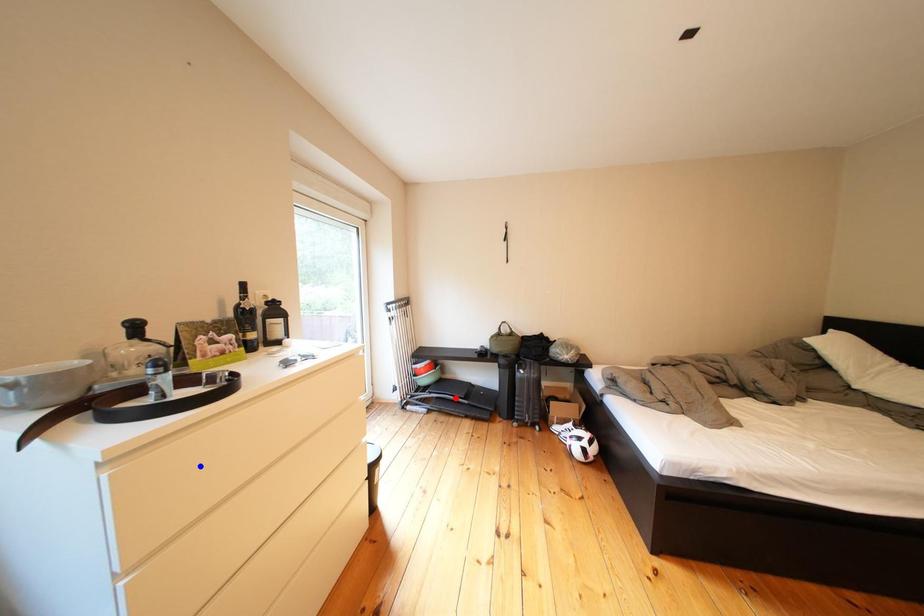
Question: Two points are marked on the image. Which point is closer to the camera?

Choices:
 (A) Blue point is closer.
 (B) Red point is closer.

Answer: (A)